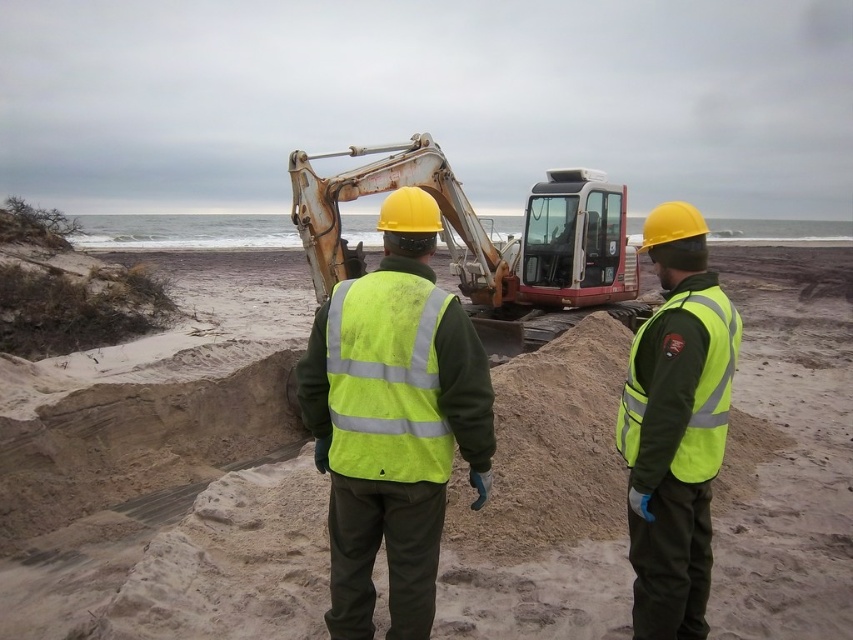
Looking at this image, can you confirm if high-visibility fabric vest at center is positioned below rusty metal excavator at center?

Indeed, high-visibility fabric vest at center is positioned under rusty metal excavator at center.

Between point (675, 301) and point (431, 140), which one is positioned in front?

Point (675, 301) is in front.

The height and width of the screenshot is (640, 853). I want to click on high-visibility fabric vest at center, so click(x=675, y=428).

You are a GUI agent. You are given a task and a screenshot of the screen. Output one action in this format:
    pyautogui.click(x=<x>, y=<y>)
    Task: Click on the high-visibility fabric vest at center
    The height and width of the screenshot is (640, 853).
    Given the screenshot: What is the action you would take?
    pyautogui.click(x=675, y=428)

Consider the image. Between high-visibility fabric vest at center and high-visibility fabric safety vest at center, which one is positioned higher?

high-visibility fabric safety vest at center is above.

Can you confirm if high-visibility fabric vest at center is bigger than high-visibility fabric safety vest at center?

Correct, high-visibility fabric vest at center is larger in size than high-visibility fabric safety vest at center.

Who is more forward, [709,390] or [390,406]?

Point [390,406]

You are a GUI agent. You are given a task and a screenshot of the screen. Output one action in this format:
    pyautogui.click(x=<x>, y=<y>)
    Task: Click on the high-visibility fabric vest at center
    The height and width of the screenshot is (640, 853).
    Given the screenshot: What is the action you would take?
    tap(675, 428)

The width and height of the screenshot is (853, 640). Describe the element at coordinates (167, 472) in the screenshot. I see `sandy beach at center` at that location.

Is sandy beach at center positioned in front of rusty metal excavator at center?

Yes, it is in front of rusty metal excavator at center.

Locate an element on the screen. sandy beach at center is located at coordinates (167, 472).

You are a GUI agent. You are given a task and a screenshot of the screen. Output one action in this format:
    pyautogui.click(x=<x>, y=<y>)
    Task: Click on the sandy beach at center
    The width and height of the screenshot is (853, 640).
    Given the screenshot: What is the action you would take?
    pyautogui.click(x=167, y=472)